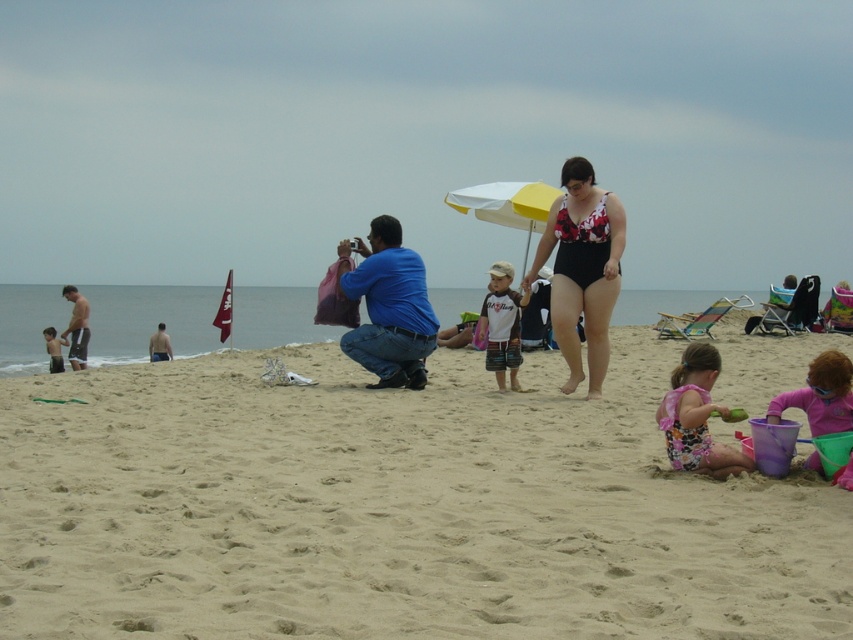
Question: Estimate the real-world distances between objects in this image. Which object is closer to the matte black shirt at left?

Choices:
 (A) pink floral swimsuit at lower right
 (B) yellow matte umbrella at center
 (C) blue cotton shirt at center
 (D) pink rubber boots at lower right

Answer: (B)

Question: Is yellow matte umbrella at center to the left of white cotton shirt at center from the viewer's perspective?

Choices:
 (A) yes
 (B) no

Answer: (B)

Question: Is pink rubber boots at lower right above yellow matte umbrella at center?

Choices:
 (A) yes
 (B) no

Answer: (B)

Question: Does blue cotton shirt at center appear on the right side of pink rubber boots at lower right?

Choices:
 (A) no
 (B) yes

Answer: (A)

Question: Which point is farther to the camera?

Choices:
 (A) (76, 344)
 (B) (160, 323)
 (C) (689, 444)

Answer: (B)

Question: Estimate the real-world distances between objects in this image. Which object is farther from the black swimsuit at center?

Choices:
 (A) white cotton shirt at center
 (B) matte black shirt at left
 (C) fine-grained sand at center

Answer: (B)